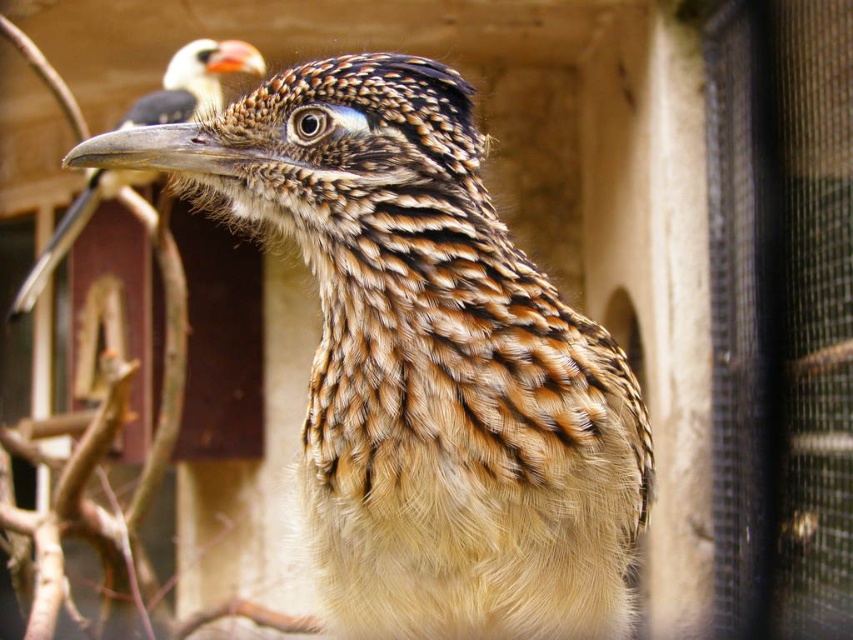
Question: Is brown speckled feathers at center closer to the viewer compared to speckled feathered bird at upper left?

Choices:
 (A) yes
 (B) no

Answer: (A)

Question: Does brown speckled feathers at center appear on the left side of speckled feathered bird at upper left?

Choices:
 (A) yes
 (B) no

Answer: (B)

Question: Can you confirm if brown speckled feathers at center is thinner than speckled feathered bird at upper left?

Choices:
 (A) no
 (B) yes

Answer: (B)

Question: Which object is farther from the camera taking this photo?

Choices:
 (A) speckled feathered bird at upper left
 (B) brown speckled feathers at center

Answer: (A)